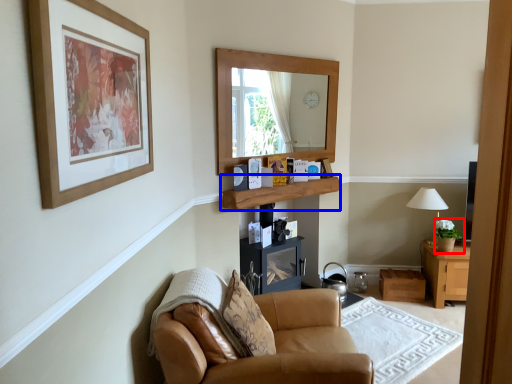
Question: Among these objects, which one is nearest to the camera, houseplant (highlighted by a red box) or shelf (highlighted by a blue box)?

Choices:
 (A) houseplant
 (B) shelf

Answer: (B)